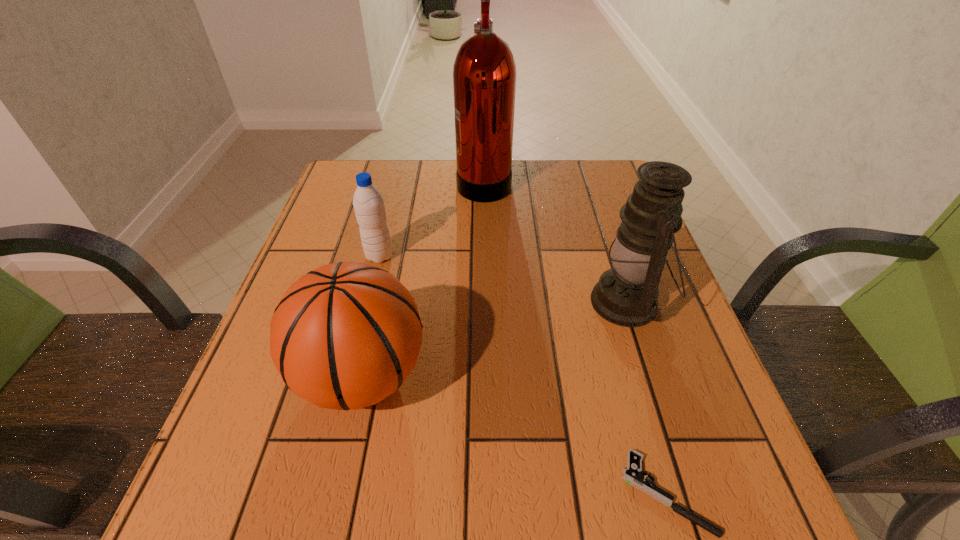
Locate an element on the screen. free space between the basketball and the oil lamp is located at coordinates (494, 339).

Where is `free space between the basketball and the farthest object`? Image resolution: width=960 pixels, height=540 pixels. free space between the basketball and the farthest object is located at coordinates (423, 279).

The image size is (960, 540). I want to click on free spot between the oil lamp and the water bottle, so click(x=503, y=279).

This screenshot has height=540, width=960. Identify the location of empty space between the shortest object and the water bottle. (522, 374).

Identify the location of vacant area that lies between the fourth nearest object and the nearest object. The height and width of the screenshot is (540, 960). (522, 374).

You are a GUI agent. You are given a task and a screenshot of the screen. Output one action in this format:
    pyautogui.click(x=<x>, y=<y>)
    Task: Click on the blank region between the water bottle and the nearest object
    The width and height of the screenshot is (960, 540).
    Given the screenshot: What is the action you would take?
    pyautogui.click(x=522, y=374)

Locate an element on the screen. unoccupied position between the pistol and the tallest object is located at coordinates (575, 337).

Locate an element on the screen. The height and width of the screenshot is (540, 960). object that is the third closest one to the fire extinguisher is located at coordinates (346, 335).

Locate which object ranks fourth in proximity to the pistol. Please provide its 2D coordinates. Your answer should be formatted as a tuple, i.e. [(x, y)], where the tuple contains the x and y coordinates of a point satisfying the conditions above.

[(484, 72)]

Identify the location of vacant space that satisfies the following two spatial constraints: 1. on the front side of the oil lamp; 2. on the front-facing side of the shortest object. This screenshot has width=960, height=540. (689, 493).